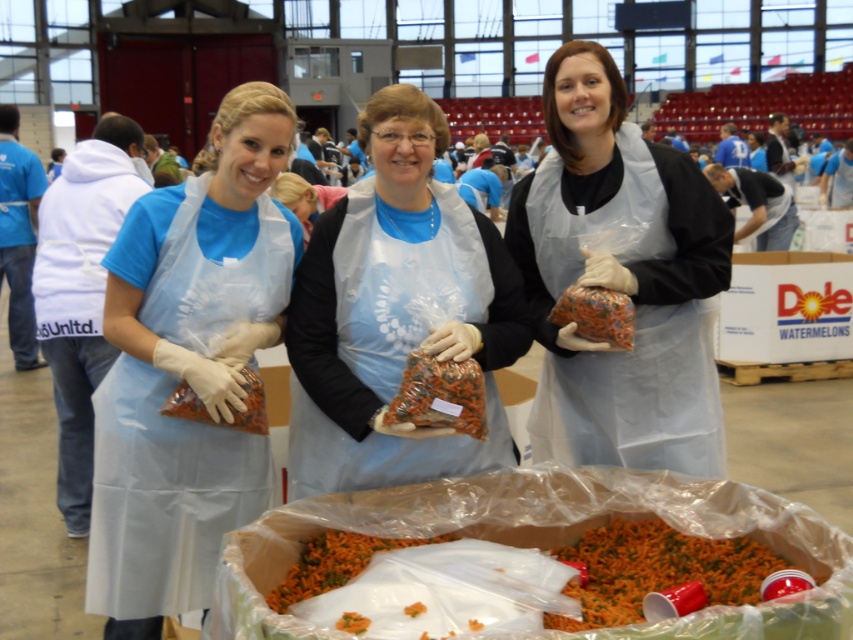
What are the coordinates of the multicolored woven fabric bag at center?

The multicolored woven fabric bag at center is located at coordinates point (595, 314).

You are standing in the hall and want to pick up the item at point (x=624, y=308). If your arm can reach up to 2 meters, can you reach it?

The point is 2.59 meters away from the viewer, which is beyond the arm reach of 2 meters. You cannot reach it.

You are a volunteer in the food distribution area and need to hand out the plastic bags. You see the clear plastic apron at center and the blue apron at center. Which apron is closer to you?

The clear plastic apron at center is closer to the viewer than the blue apron at center.